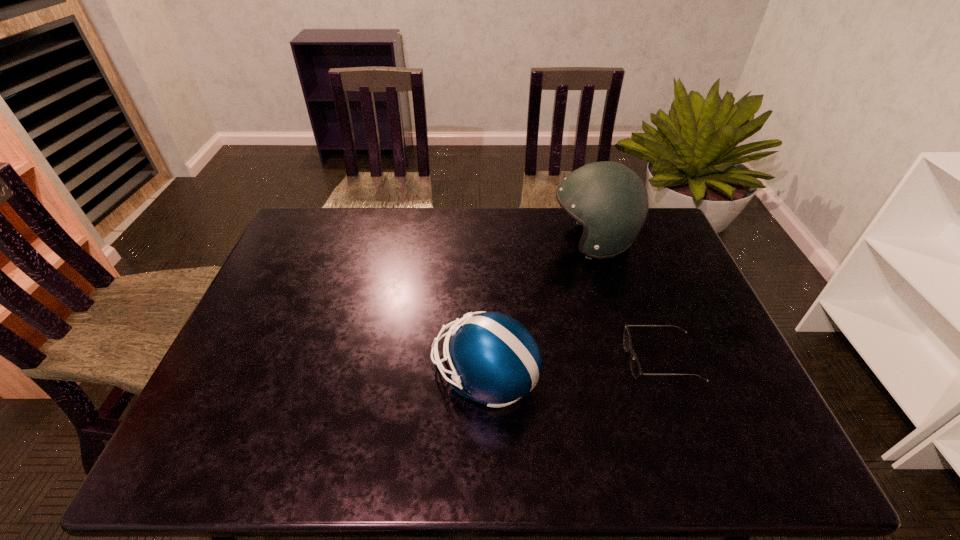
The width and height of the screenshot is (960, 540). I want to click on vacant point located between the shortest object and the farther football helmet, so click(627, 301).

The width and height of the screenshot is (960, 540). I want to click on vacant area that lies between the farthest object and the shorter football helmet, so click(x=539, y=308).

You are a GUI agent. You are given a task and a screenshot of the screen. Output one action in this format:
    pyautogui.click(x=<x>, y=<y>)
    Task: Click on the vacant region between the shortest object and the second shortest object
    
    Given the screenshot: What is the action you would take?
    pyautogui.click(x=572, y=368)

You are a GUI agent. You are given a task and a screenshot of the screen. Output one action in this format:
    pyautogui.click(x=<x>, y=<y>)
    Task: Click on the object that is the closest to the tallest object
    
    Given the screenshot: What is the action you would take?
    pyautogui.click(x=635, y=367)

What are the coordinates of `object that ranks as the closest to the farthest object` in the screenshot? It's located at (635, 367).